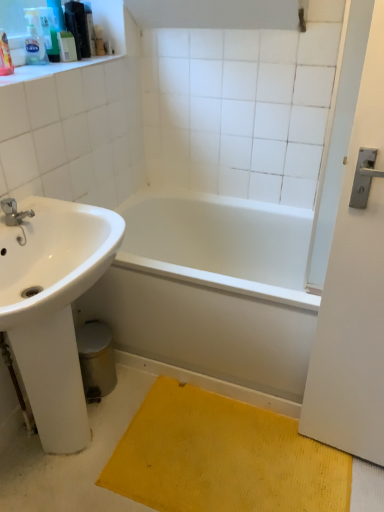
Question: Would you say white plastic container at upper left, the first toiletry when ordered from right to left, is to the left or to the right of translucent plastic soap dispenser at upper left, the second toiletry viewed from the right, in the picture?

Choices:
 (A) left
 (B) right

Answer: (B)

Question: In terms of size, does white plastic container at upper left, which appears as the third toiletry when viewed from the left, appear bigger or smaller than translucent plastic soap dispenser at upper left, which is counted as the 2th toiletry, starting from the left?

Choices:
 (A) big
 (B) small

Answer: (B)

Question: Based on their relative distances, which object is nearer to the translucent plastic soap dispenser at upper left, arranged as the 1th toiletry when viewed from the left?

Choices:
 (A) white glossy sink at left
 (B) yellow textured mat at lower right
 (C) white glossy bathtub at center
 (D) brushed metal faucet at left
 (E) white plastic container at upper left, which appears as the third toiletry when viewed from the left

Answer: (E)

Question: Which object is the farthest from the brushed metal faucet at left?

Choices:
 (A) white glossy bathtub at center
 (B) translucent plastic soap dispenser at upper left, the second toiletry viewed from the right
 (C) white plastic container at upper left, the first toiletry when ordered from right to left
 (D) yellow textured mat at lower right
 (E) translucent plastic soap dispenser at upper left, which is counted as the 3th toiletry, starting from the right

Answer: (D)